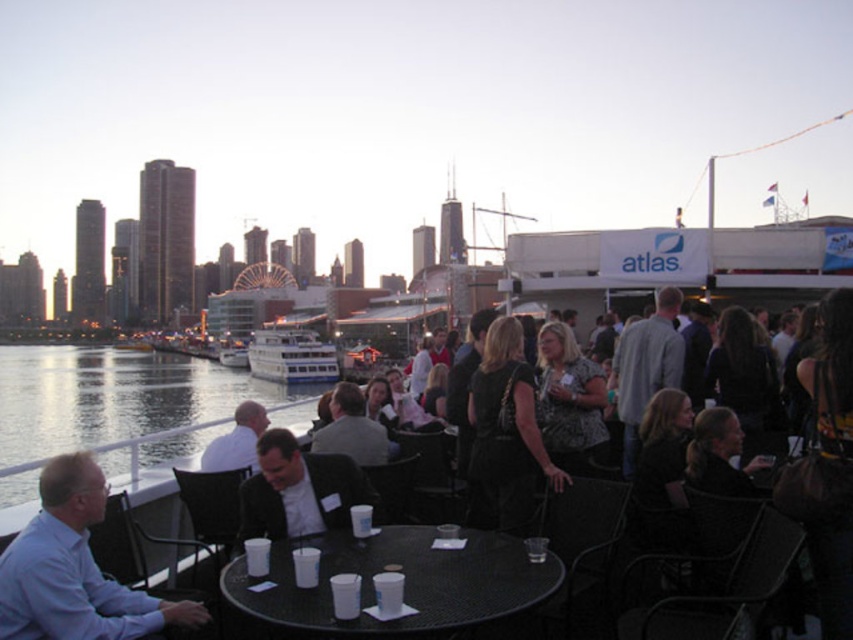
You are standing at the waterfront event and want to walk from the point marked at coordinate point (514, 529) to the point marked at coordinate point (206, 451). Which direction should you move relative to the city skyline?

You should move towards the city skyline because point (514, 529) is in front of point (206, 451), meaning the latter is closer to the skyline backdrop.

Based on the photo, you are a photographer at the waterfront event. You need to position a spotlight at the center of the scene. Is the black leather dress at center within the spotlight area if the spotlight is placed at point 0.680, 0.593?

Yes, the black leather dress at center is exactly at point (x=505, y=435), so the spotlight placed there will illuminate it directly.